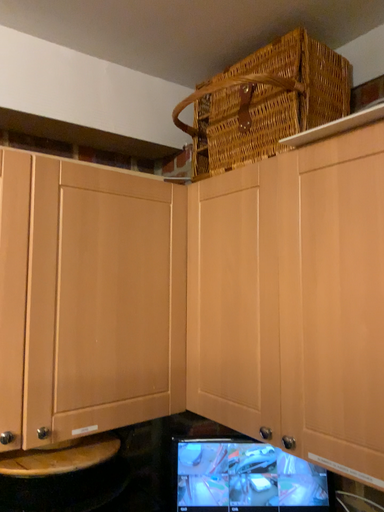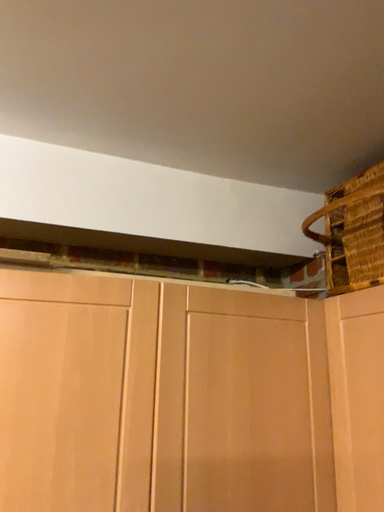
Question: Which way did the camera rotate in the video?

Choices:
 (A) rotated downward
 (B) rotated upward

Answer: (B)